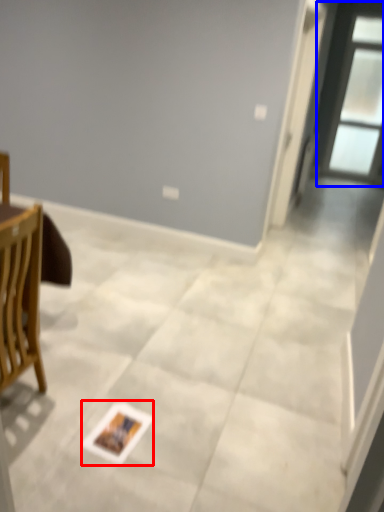
Question: Which of the following is the closest to the observer, postcard (highlighted by a red box) or window (highlighted by a blue box)?

Choices:
 (A) postcard
 (B) window

Answer: (A)